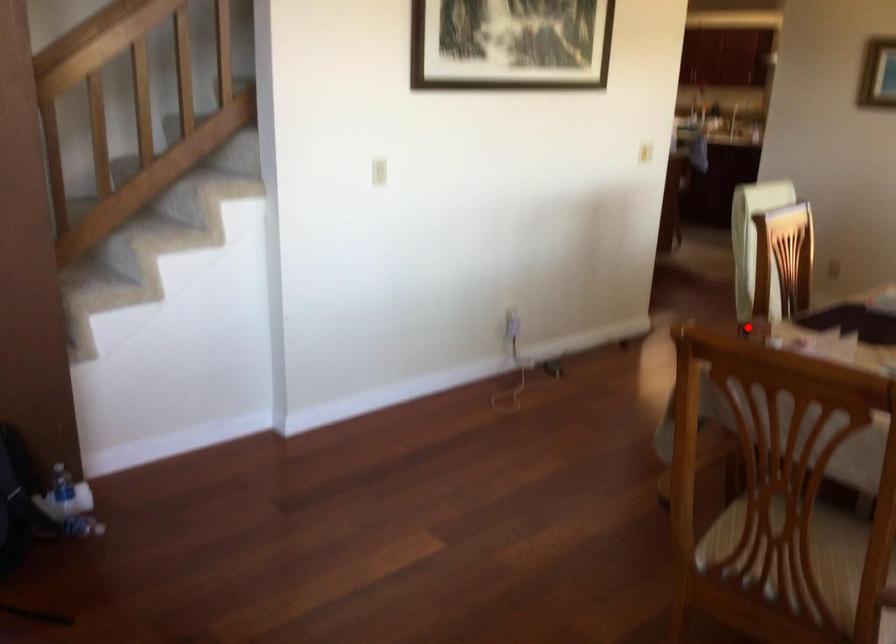
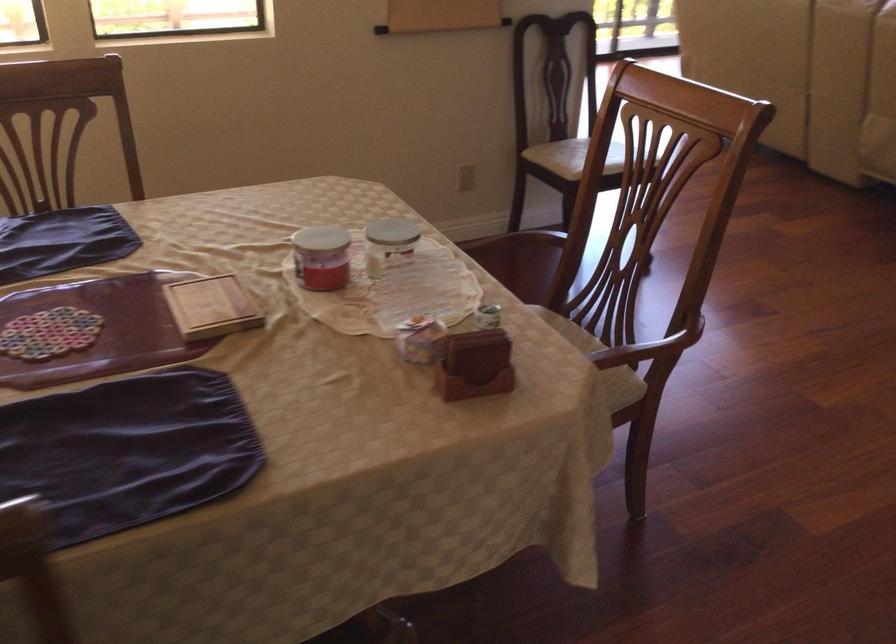
Question: I am providing you with two images of the same scene from different viewpoints. Image1 has a red point marked. In image2, the corresponding 3D location appears at what relative position? Reply with the corresponding letter.

Choices:
 (A) Closer
 (B) Farther

Answer: (A)